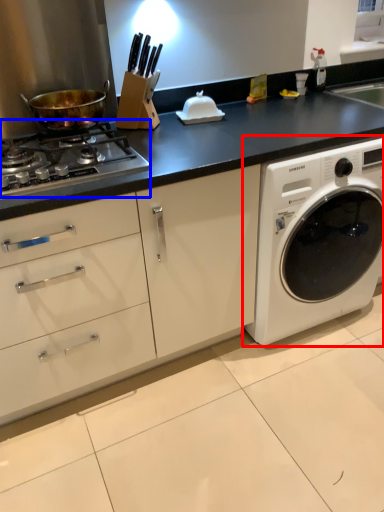
Question: Among these objects, which one is nearest to the camera, washing machine (highlighted by a red box) or gas stove (highlighted by a blue box)?

Choices:
 (A) washing machine
 (B) gas stove

Answer: (B)